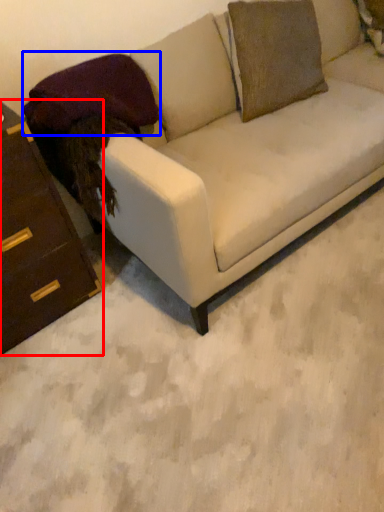
Question: Which of the following is the closest to the observer, chest of drawers (highlighted by a red box) or pillow (highlighted by a blue box)?

Choices:
 (A) chest of drawers
 (B) pillow

Answer: (A)